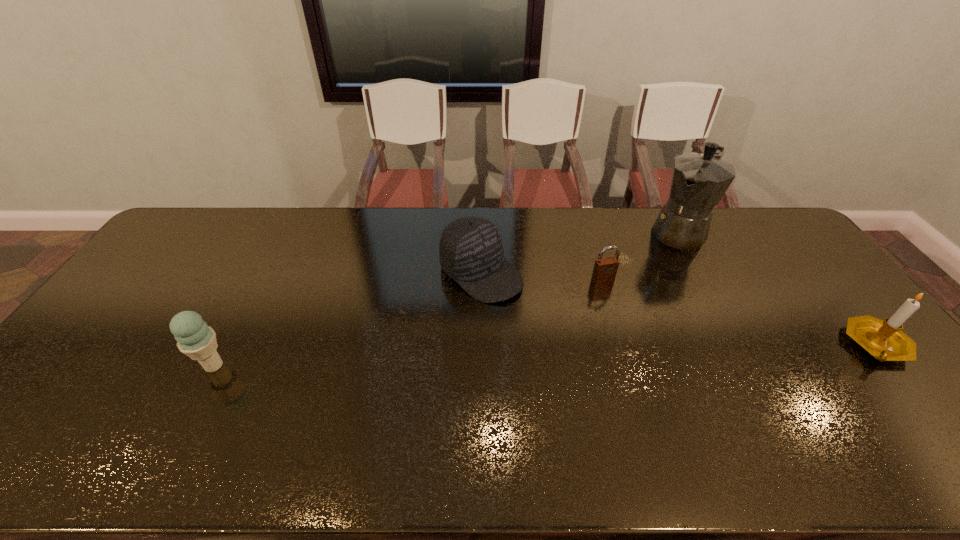
Identify the location of the leftmost object. (197, 340).

In order to click on candle holder in this screenshot , I will do `click(884, 340)`.

You are a GUI agent. You are given a task and a screenshot of the screen. Output one action in this format:
    pyautogui.click(x=<x>, y=<y>)
    Task: Click on the shortest object
    
    Given the screenshot: What is the action you would take?
    pyautogui.click(x=605, y=269)

What are the coordinates of `the third object from right to left` in the screenshot? It's located at (605, 269).

At what (x,y) coordinates should I click in order to perform the action: click on coffeepot. Please return your answer as a coordinate pair (x, y). Image resolution: width=960 pixels, height=540 pixels. Looking at the image, I should click on (698, 182).

Where is `the tallest object`? the tallest object is located at coordinates (698, 182).

You are a GUI agent. You are given a task and a screenshot of the screen. Output one action in this format:
    pyautogui.click(x=<x>, y=<y>)
    Task: Click on the baseball cap
    
    Given the screenshot: What is the action you would take?
    pyautogui.click(x=471, y=252)

In order to click on vacant space located on the back of the leftmost object in this screenshot , I will do `click(266, 268)`.

I want to click on vacant space located 0.180m on the back of the rightmost object, so click(x=821, y=278).

I want to click on free space located on the front-facing side of the shortest object, so click(x=655, y=361).